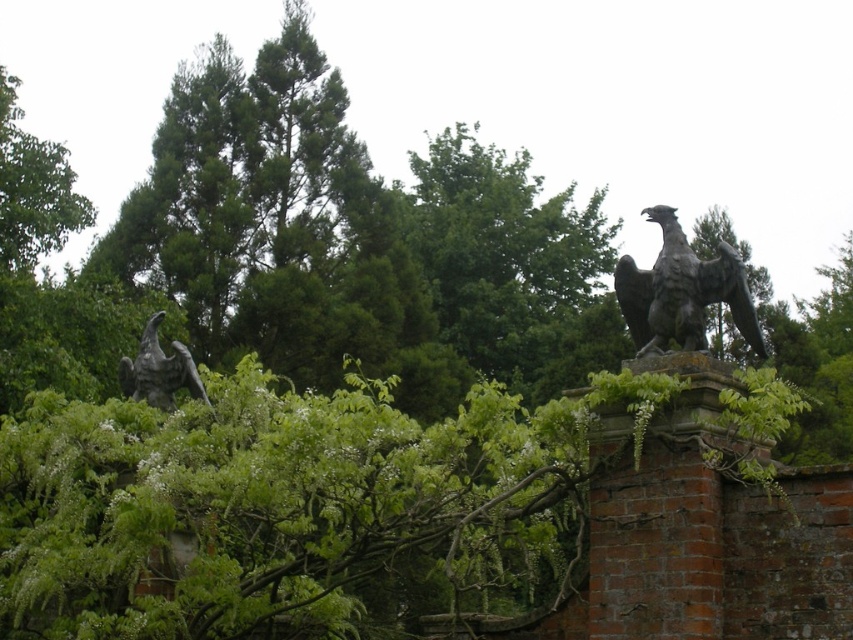
Question: Does polished bronze eagle at upper right appear under polished bronze eagle at left?

Choices:
 (A) yes
 (B) no

Answer: (B)

Question: Is polished bronze eagle at upper right thinner than polished bronze eagle at left?

Choices:
 (A) yes
 (B) no

Answer: (B)

Question: Which object appears closest to the camera in this image?

Choices:
 (A) polished bronze eagle at left
 (B) polished bronze eagle at upper right

Answer: (B)

Question: Does polished bronze eagle at upper right appear on the left side of polished bronze eagle at left?

Choices:
 (A) no
 (B) yes

Answer: (A)